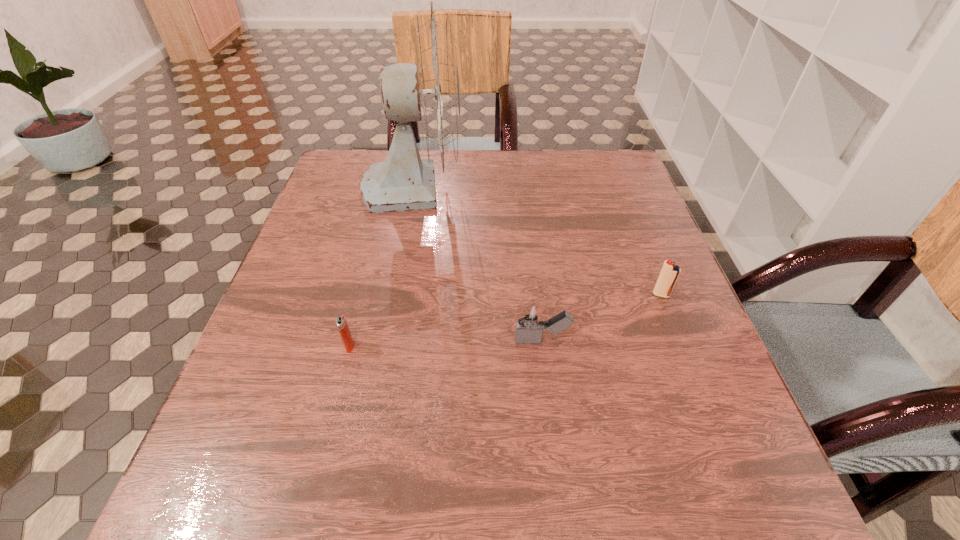
Locate which object is the third closest to the farthest object. Please provide its 2D coordinates. Your answer should be formatted as a tuple, i.e. [(x, y)], where the tuple contains the x and y coordinates of a point satisfying the conditions above.

[(669, 274)]

Choose which object is the third nearest neighbor to the second farthest object. Please provide its 2D coordinates. Your answer should be formatted as a tuple, i.e. [(x, y)], where the tuple contains the x and y coordinates of a point satisfying the conditions above.

[(341, 322)]

Identify the location of igniter that stands as the second closest to the second igniter from right to left. This screenshot has width=960, height=540. (341, 322).

Identify which igniter is the nearest to the second igniter from left to right. Please provide its 2D coordinates. Your answer should be formatted as a tuple, i.e. [(x, y)], where the tuple contains the x and y coordinates of a point satisfying the conditions above.

[(669, 274)]

You are a GUI agent. You are given a task and a screenshot of the screen. Output one action in this format:
    pyautogui.click(x=<x>, y=<y>)
    Task: Click on the vacant position in the image that satisfies the following two spatial constraints: 1. in front of the fan to blow air; 2. on the left side of the rightmost object
    
    Given the screenshot: What is the action you would take?
    pyautogui.click(x=393, y=295)

At what (x,y) coordinates should I click in order to perform the action: click on vacant space that satisfies the following two spatial constraints: 1. on the back side of the farthest igniter; 2. on the left side of the second igniter from right to left. Please return your answer as a coordinate pair (x, y). This screenshot has height=540, width=960. Looking at the image, I should click on pos(537,295).

Locate an element on the screen. This screenshot has width=960, height=540. vacant area in the image that satisfies the following two spatial constraints: 1. in front of the third object from left to right to blow air; 2. on the left side of the fan is located at coordinates (384, 341).

You are a GUI agent. You are given a task and a screenshot of the screen. Output one action in this format:
    pyautogui.click(x=<x>, y=<y>)
    Task: Click on the vacant space that satisfies the following two spatial constraints: 1. on the back side of the leftmost igniter; 2. on the left side of the third object from left to right
    
    Given the screenshot: What is the action you would take?
    pyautogui.click(x=351, y=341)

Locate an element on the screen. The height and width of the screenshot is (540, 960). free space that satisfies the following two spatial constraints: 1. in front of the fan to blow air; 2. on the left side of the second igniter from left to right is located at coordinates (384, 341).

Locate an element on the screen. free space that satisfies the following two spatial constraints: 1. in front of the third nearest object to blow air; 2. on the left side of the tallest object is located at coordinates (393, 295).